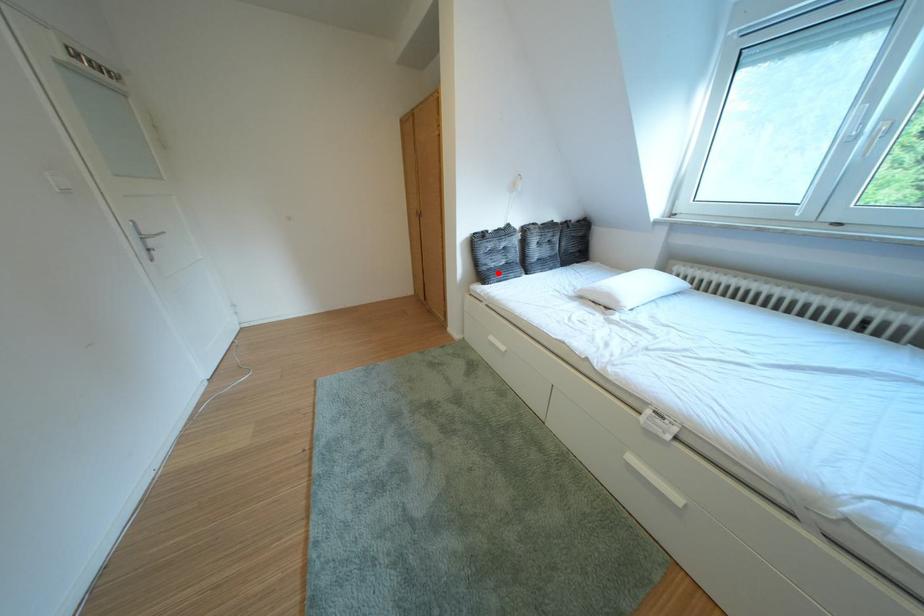
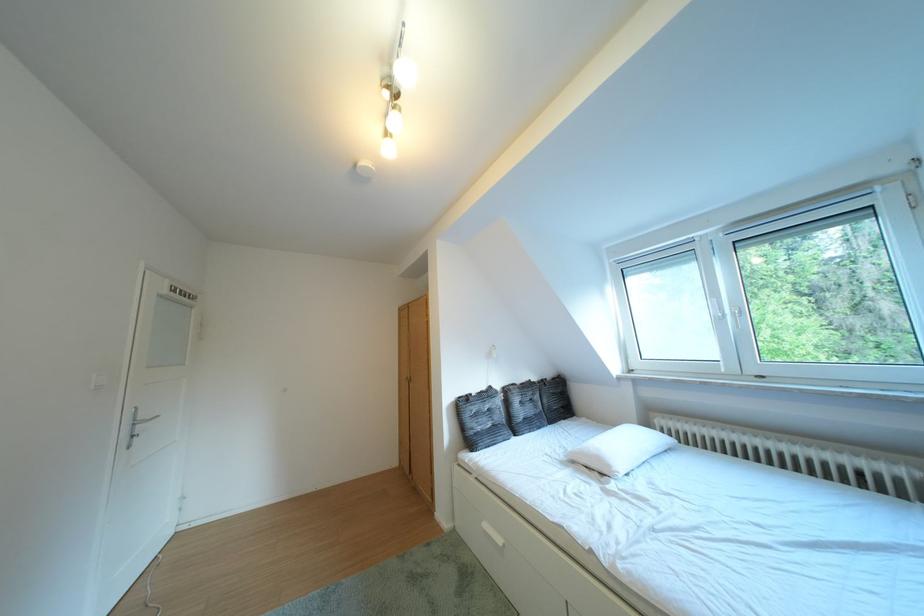
Question: I am providing you with two images of the same scene from different viewpoints. A red point is shown in image1. For the corresponding object point in image2, is it positioned nearer or farther from the camera?

Choices:
 (A) Nearer
 (B) Farther

Answer: (B)